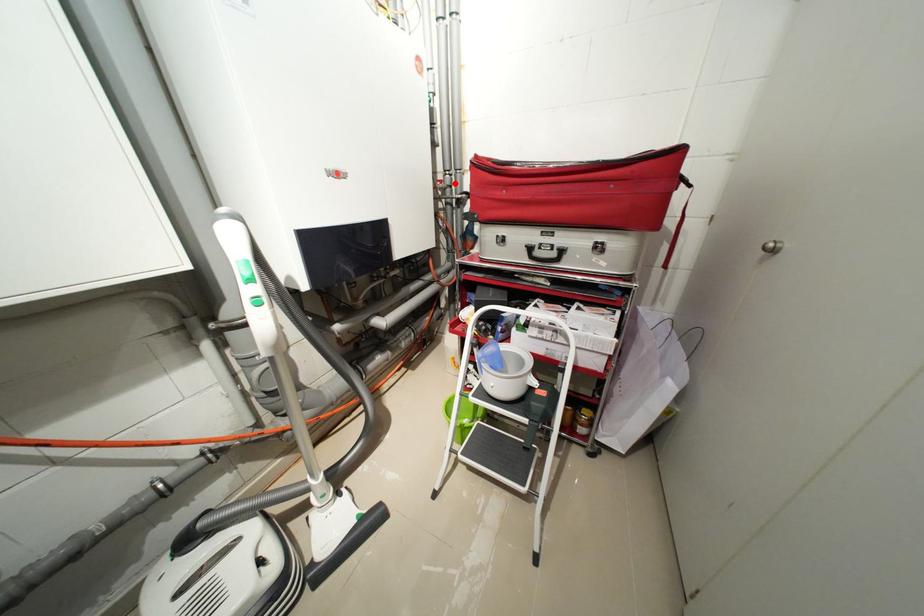
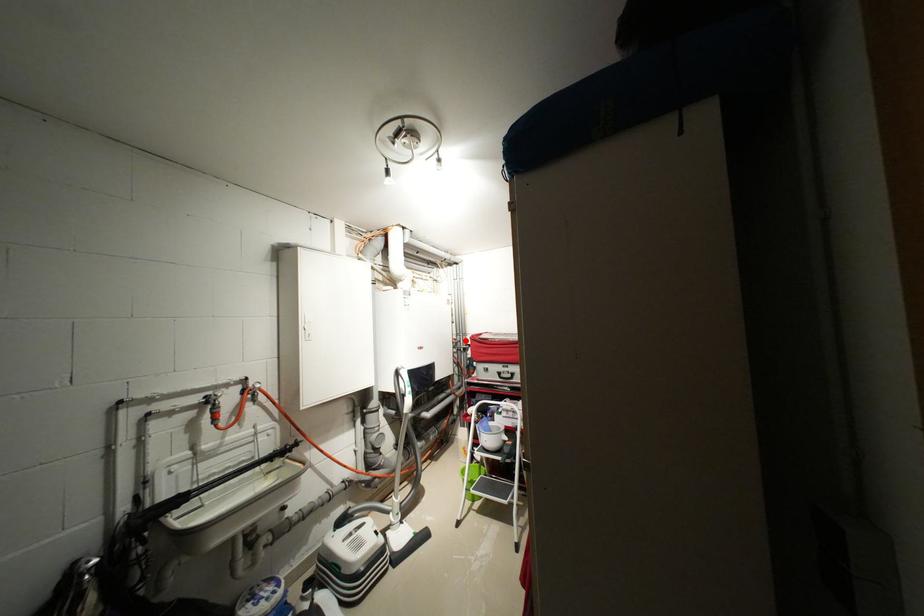
I am providing you with two images of the same scene from different viewpoints. A red point is marked on the first image and another point is marked on the second image. Do the highlighted points in image1 and image2 indicate the same real-world spot?

Yes